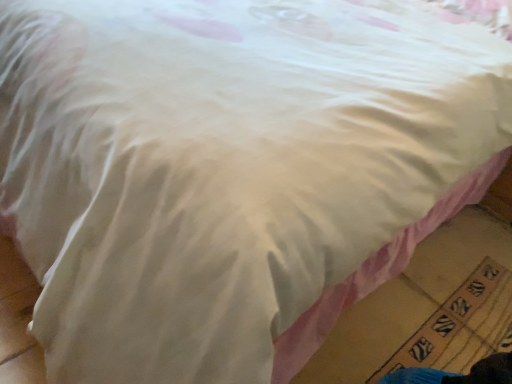
Describe the element at coordinates (461, 326) in the screenshot. I see `brown woven mat at lower right` at that location.

Consider the image. Measure the distance between brown woven mat at lower right and camera.

brown woven mat at lower right is 38.64 inches away from camera.

Find the location of a particular element. Image resolution: width=512 pixels, height=384 pixels. brown woven mat at lower right is located at coordinates (461, 326).

This screenshot has width=512, height=384. I want to click on brown woven mat at lower right, so click(x=461, y=326).